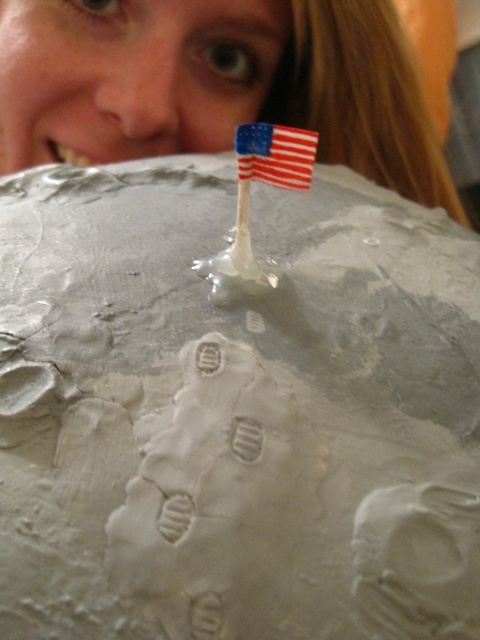
You are looking at the moon cake and want to place a cherry exactly halfway between point A at point (191, 145) and point B at point (292, 147). Will the cherry be closer to the camera than point B?

Yes, because the midpoint between point A and point B will be closer to the camera than point B since point A is closer to the camera than point B.

What is located at the point with coordinates (132, 76) on the cake?

The matte skin at upper center is located at point (132, 76).

You are a baker inspecting a moon cake and notice the matte skin at upper center. Where exactly on the cake is this feature located in terms of coordinates?

The matte skin at upper center is located at point coordinates of (x=132, y=76).